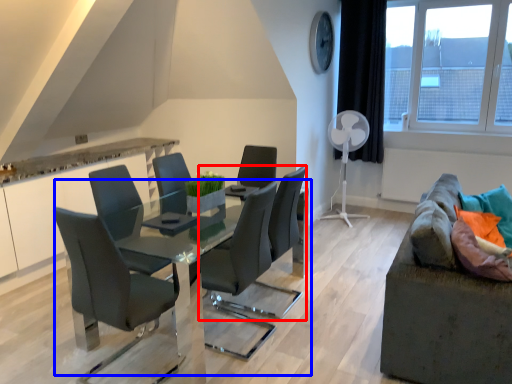
Question: Which object appears farthest to the camera in this image, chair (highlighted by a red box) or table (highlighted by a blue box)?

Choices:
 (A) chair
 (B) table

Answer: (A)